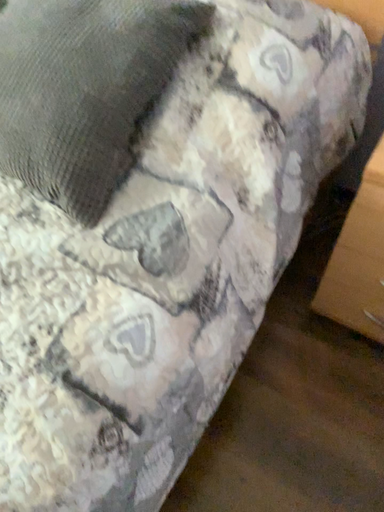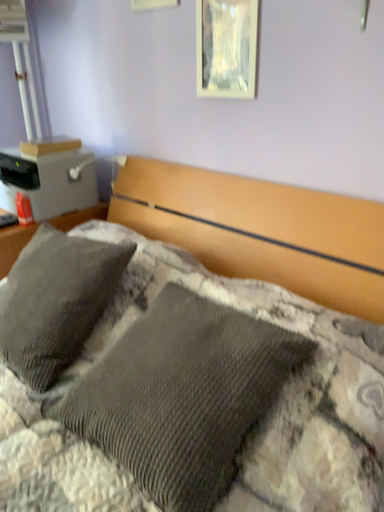
Question: Which way did the camera rotate in the video?

Choices:
 (A) rotated upward
 (B) rotated downward

Answer: (A)